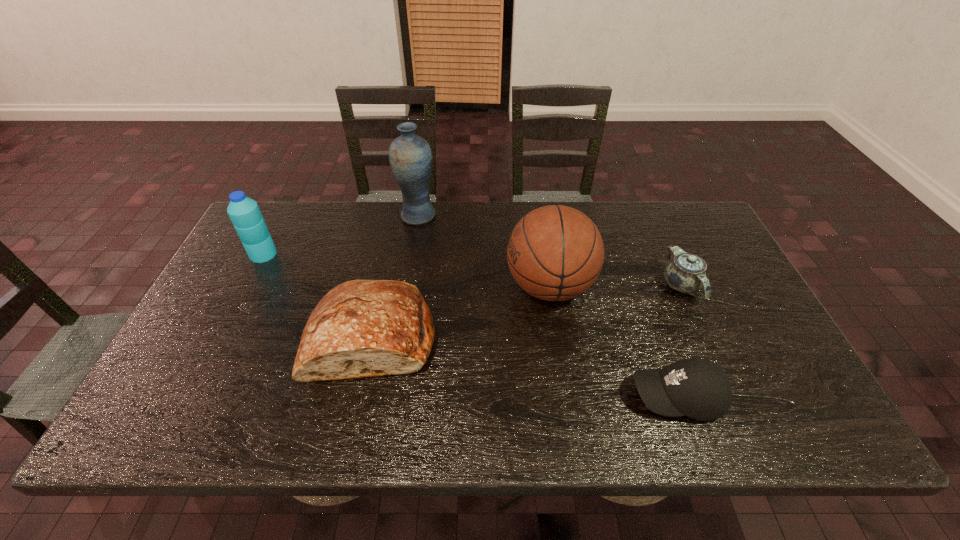
Where is `object at the near edge`? The image size is (960, 540). object at the near edge is located at coordinates (698, 388).

This screenshot has height=540, width=960. I want to click on object at the left edge, so click(244, 212).

Find the location of a particular element. Image resolution: width=960 pixels, height=540 pixels. object that is positioned at the right edge is located at coordinates tap(686, 273).

Find the location of `object positioned at the far left corner`. object positioned at the far left corner is located at coordinates point(244,212).

The height and width of the screenshot is (540, 960). Find the location of `free location at the far edge`. free location at the far edge is located at coordinates (451, 201).

In the image, there is a desktop. Identify the location of vacant area at the near edge. (446, 422).

Identify the location of vacant space at the left edge of the desktop. (277, 275).

Where is `blank area at the right edge`? blank area at the right edge is located at coordinates (786, 392).

The width and height of the screenshot is (960, 540). What are the coordinates of `vacant point at the far right corner` in the screenshot? It's located at (709, 226).

Where is `vacant space that is in between the baseball cap and the tallest object`? The height and width of the screenshot is (540, 960). vacant space that is in between the baseball cap and the tallest object is located at coordinates (547, 306).